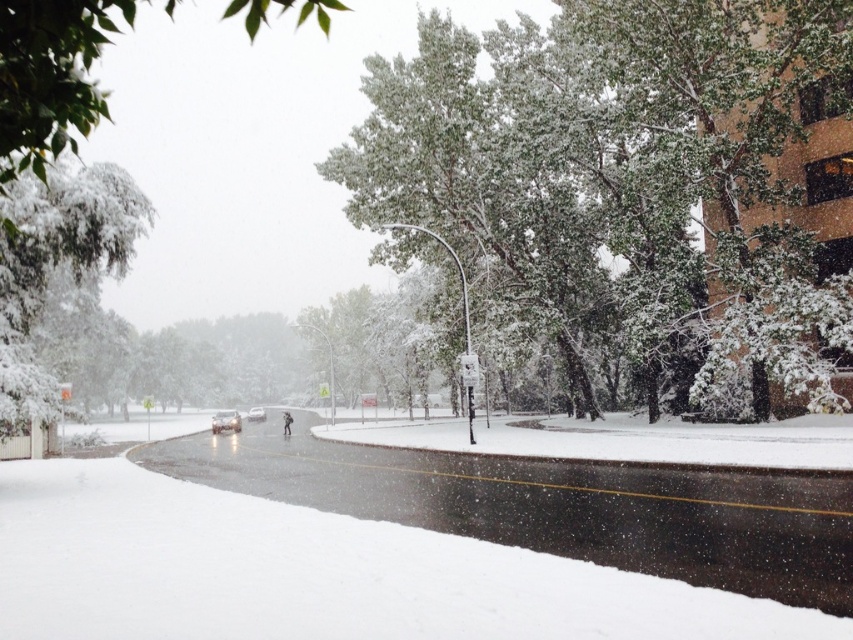
You are a pedestrian trying to cross the road safely. You see the white fluffy snow at center and the green leafy tree at upper left. Which object is closer to you from your perspective?

The white fluffy snow at center is closer to you because the green leafy tree at upper left is behind it.